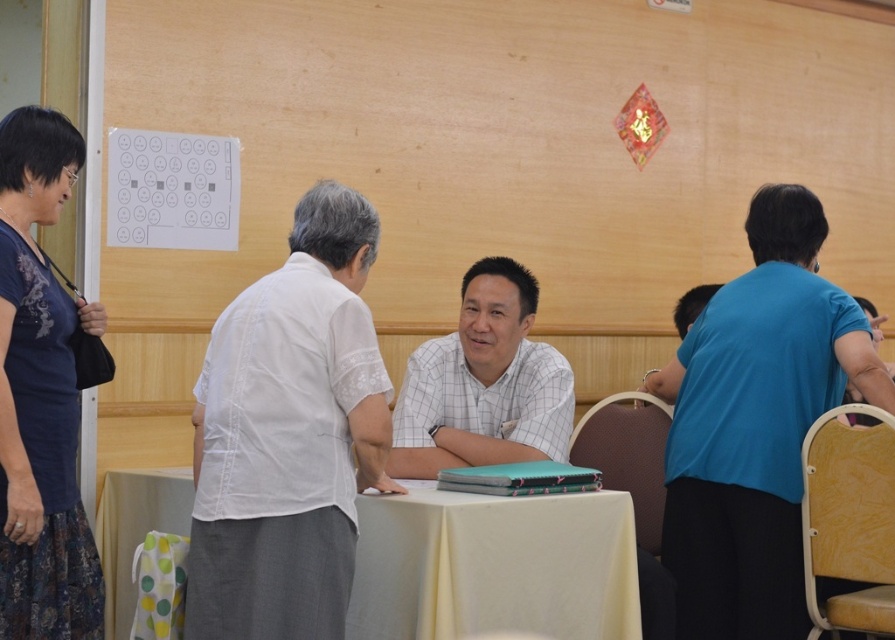
You are organizing a small event and need to determine if the white cotton shirt at center can be placed on the yellow fabric table at center without covering the entire surface. Based on their sizes, what is your assessment?

The white cotton shirt at center is larger in size than the yellow fabric table at center, so placing it would cover the entire surface of the yellow fabric table at center.

You are attending a cultural event and see a yellow fabric table at center and a dark blue fabric dress at left. Which object is located to the right of the other?

The yellow fabric table at center is positioned on the right side of dark blue fabric dress at left.

You are standing in the room and want to find the white cotton shirt at center. According to the scene description, where should you look to find it?

The white cotton shirt at center is located at the 2D coordinates point (288, 435) in the scene.